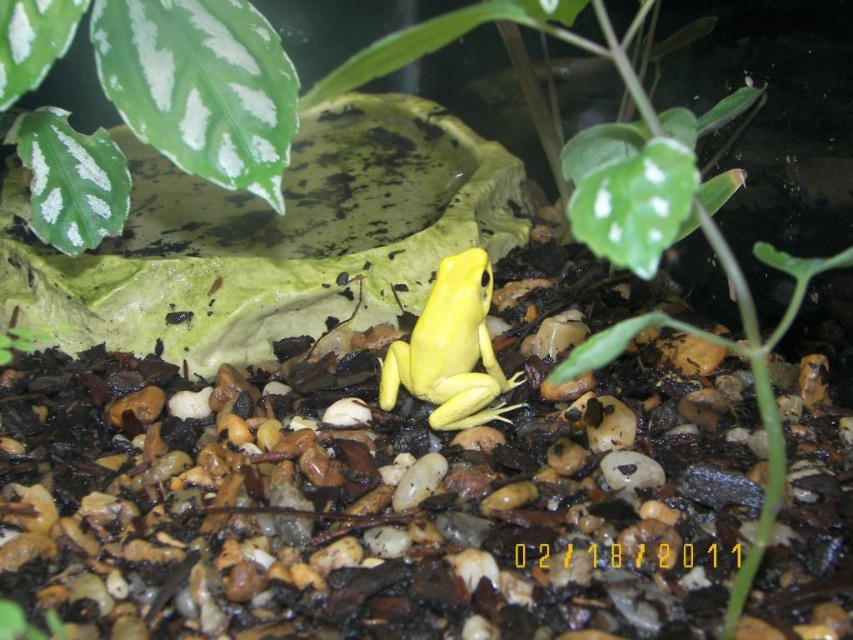
You are an observer looking at the terrarium. The frog is at the center. Where is the white matte leaf at upper left located relative to the frog?

The white matte leaf at upper left is located at point (172, 77) relative to the frog.